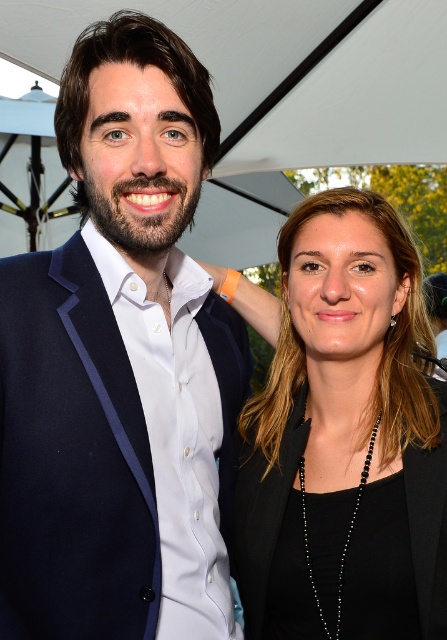
You are at an outdoor event and see two people. The man on the left is wearing a matte blue suit at left, and the woman in the center is wearing a black matte blazer at center. Which clothing item is positioned more to the left?

The matte blue suit at left is positioned more to the left than the black matte blazer at center.

You are a photographer at the event and need to adjust the lighting to focus on the matte blue suit at left. Where should you position the light source relative to the camera to ensure the suit is well lit?

The matte blue suit at left is located at point (122, 365). To ensure proper lighting, position the light source directly in front of the camera, slightly to the left to illuminate the suit effectively.

You are a photographer at an outdoor event. You need to adjust the lighting to ensure both the matte blue suit at left and the black matte blazer at center are well lit. Given their positions, which one might require more adjustment to avoid shadows?

The matte blue suit at left is located above the black matte blazer at center. Since it is higher up, it might cast a shadow on the lower one, so the black matte blazer at center could need more adjustment to avoid shadows caused by the suit above.